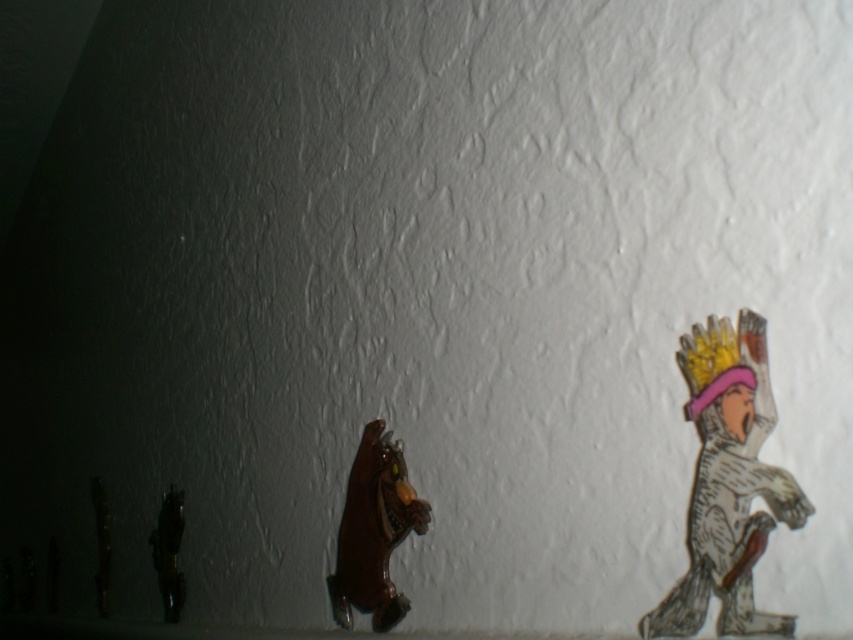
Question: Which object is farther from the camera taking this photo?

Choices:
 (A) wooden crown figure at right
 (B) shiny black figurine at left
 (C) brown glossy bear at center

Answer: (B)

Question: Which point appears farthest from the camera in this image?

Choices:
 (A) (372, 445)
 (B) (175, 616)

Answer: (B)

Question: Which object is positioned farthest from the wooden crown figure at right?

Choices:
 (A) brown glossy bear at center
 (B) shiny black figurine at left

Answer: (B)

Question: Can you confirm if wooden crown figure at right is bigger than brown glossy bear at center?

Choices:
 (A) no
 (B) yes

Answer: (A)

Question: Does wooden crown figure at right appear under brown glossy bear at center?

Choices:
 (A) yes
 (B) no

Answer: (B)

Question: Does wooden crown figure at right appear under brown glossy bear at center?

Choices:
 (A) no
 (B) yes

Answer: (A)